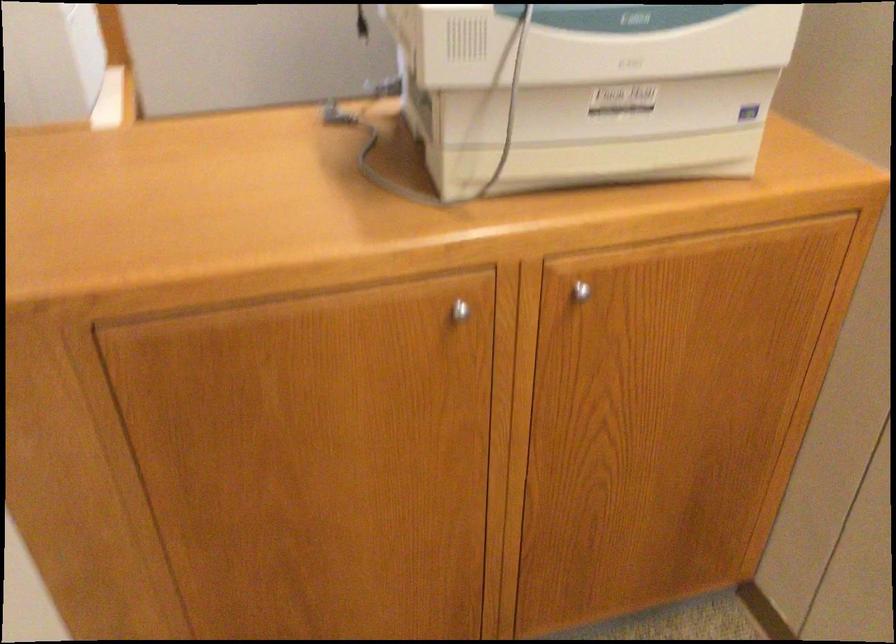
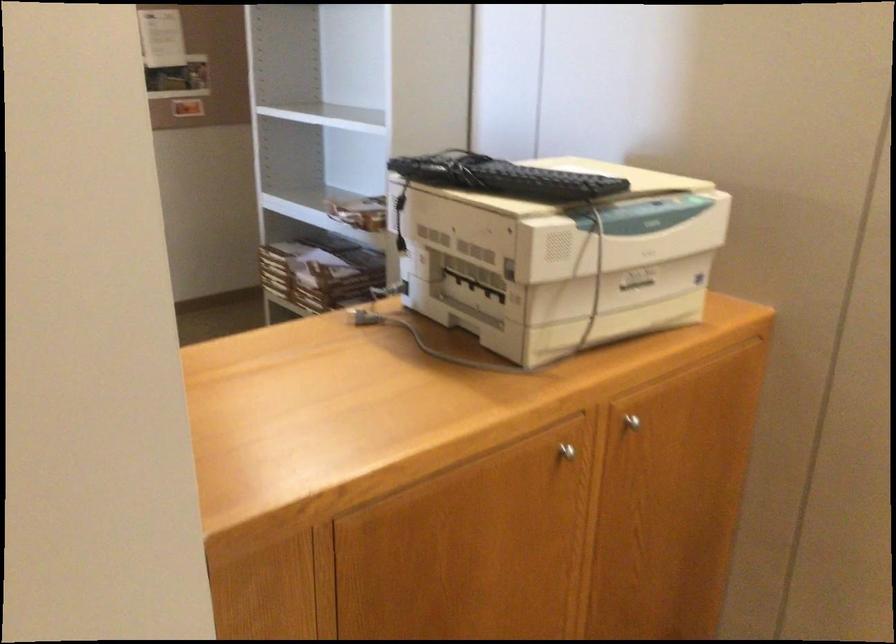
Question: Which direction would the cameraman need to move to produce the second image? Reply with the corresponding letter.

Choices:
 (A) Left
 (B) Right
 (C) Forward
 (D) Backward

Answer: (D)